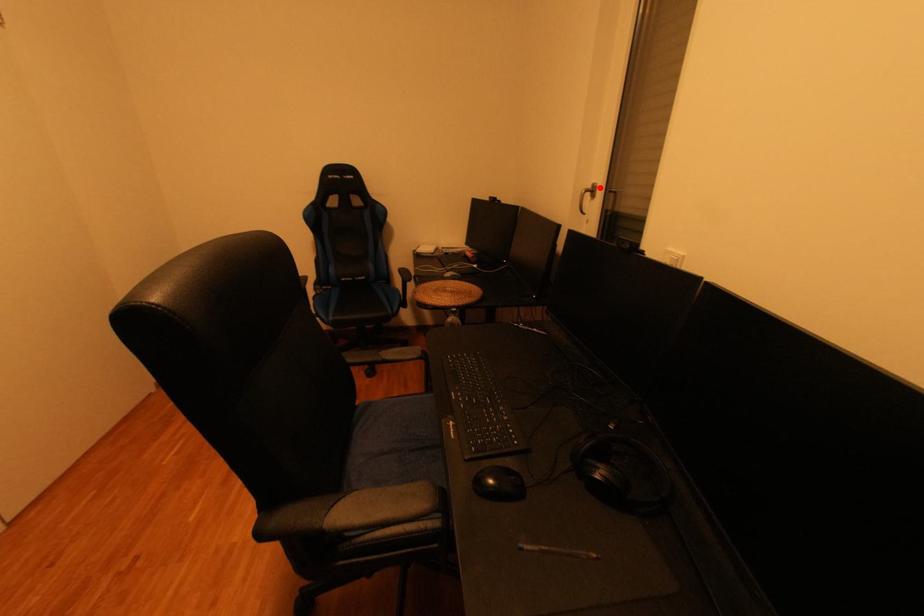
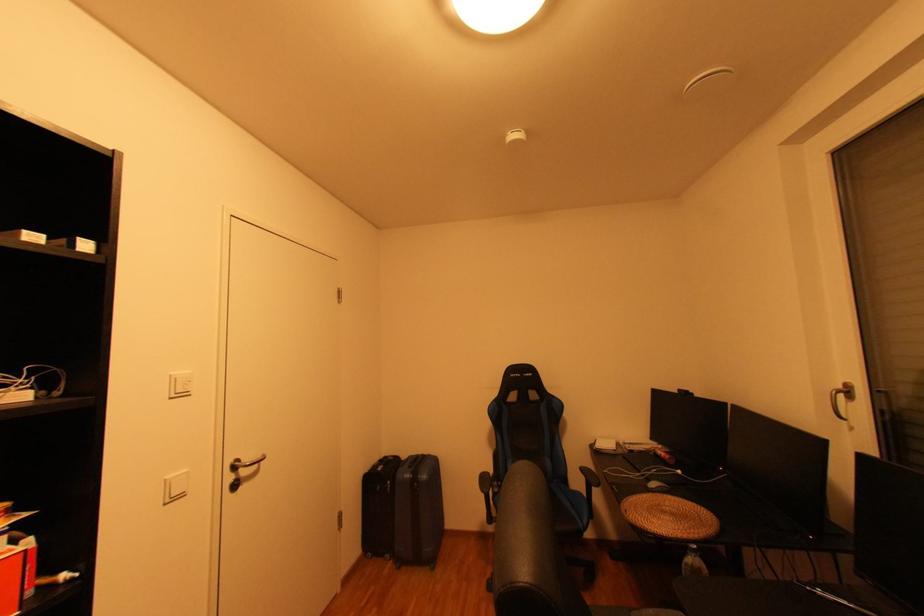
Find the pixel in the second image that matches the highlighted location in the first image.

(849, 387)